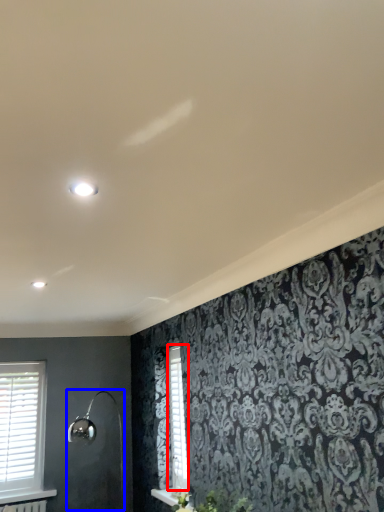
Question: Among these objects, which one is farthest to the camera, shutter (highlighted by a red box) or shower (highlighted by a blue box)?

Choices:
 (A) shutter
 (B) shower

Answer: (A)